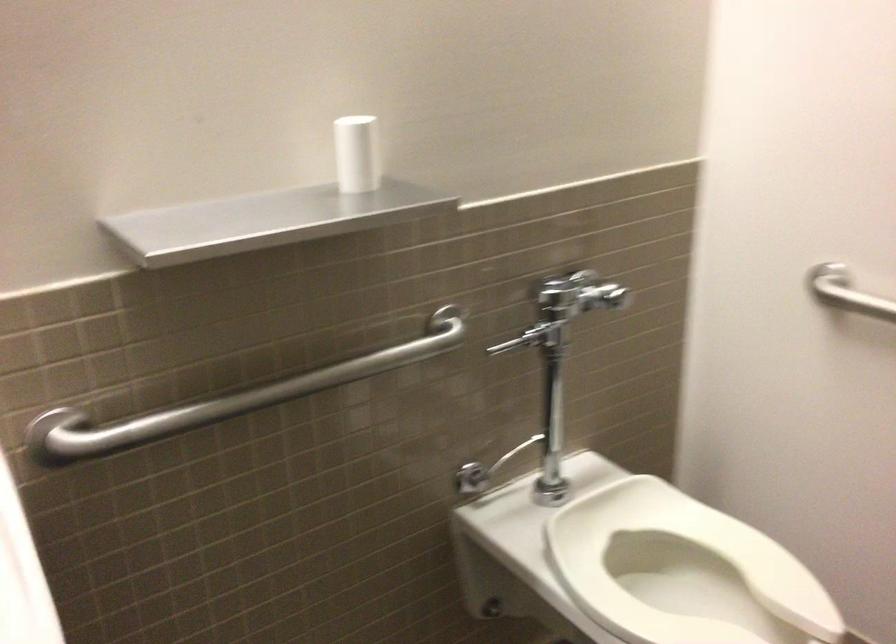
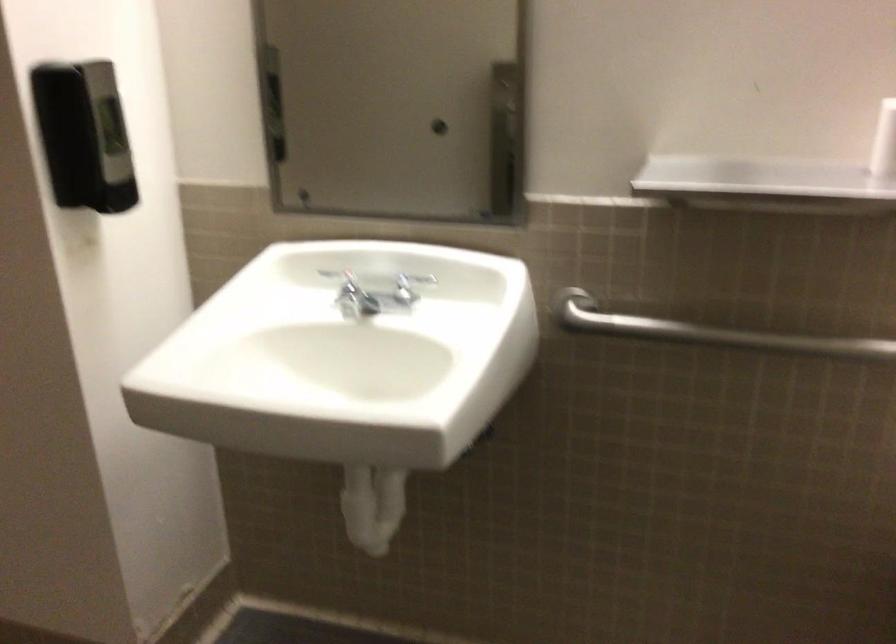
In the second image, find the point that corresponds to the point at 250,402 in the first image.

(707, 332)